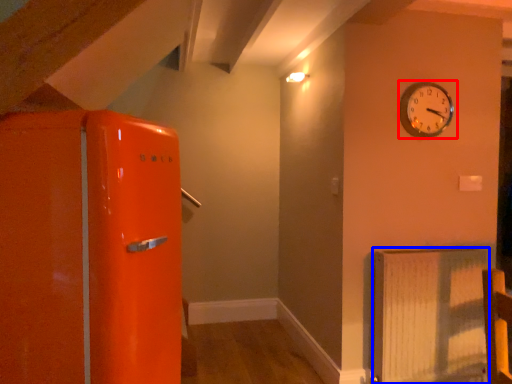
Question: Which object appears closest to the camera in this image, wall clock (highlighted by a red box) or radiator (highlighted by a blue box)?

Choices:
 (A) wall clock
 (B) radiator

Answer: (B)